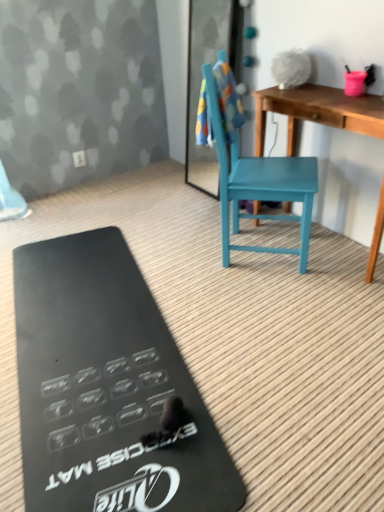
At what (x,y) coordinates should I click in order to perform the action: click on vacant area that lies in front of teal wood chair at center. Please return your answer as a coordinate pair (x, y). This screenshot has width=384, height=512. Looking at the image, I should click on (278, 298).